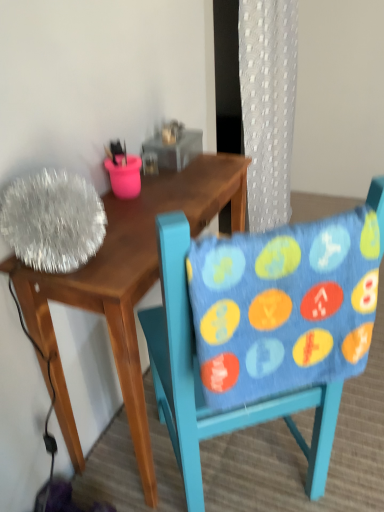
Question: From the image's perspective, is blue fabric chair at center located beneath blue fabric pillow at center?

Choices:
 (A) no
 (B) yes

Answer: (B)

Question: Does blue fabric chair at center turn towards blue fabric pillow at center?

Choices:
 (A) no
 (B) yes

Answer: (A)

Question: Can you confirm if blue fabric chair at center is positioned to the left of blue fabric pillow at center?

Choices:
 (A) yes
 (B) no

Answer: (A)

Question: Is blue fabric pillow at center inside blue fabric chair at center?

Choices:
 (A) no
 (B) yes

Answer: (B)

Question: Is blue fabric chair at center bigger than blue fabric pillow at center?

Choices:
 (A) yes
 (B) no

Answer: (A)

Question: Choose the correct answer: Is wooden desk at left inside blue fabric pillow at center or outside it?

Choices:
 (A) outside
 (B) inside

Answer: (A)

Question: From the image's perspective, is wooden desk at left positioned above or below blue fabric pillow at center?

Choices:
 (A) above
 (B) below

Answer: (B)

Question: Relative to blue fabric pillow at center, is wooden desk at left in front or behind?

Choices:
 (A) behind
 (B) front

Answer: (A)

Question: Considering the relative positions of wooden desk at left and blue fabric pillow at center in the image provided, is wooden desk at left to the left or to the right of blue fabric pillow at center?

Choices:
 (A) right
 (B) left

Answer: (B)

Question: Is blue fabric chair at center taller or shorter than blue fabric pillow at center?

Choices:
 (A) short
 (B) tall

Answer: (B)

Question: Looking at their shapes, would you say blue fabric chair at center is wider or thinner than blue fabric pillow at center?

Choices:
 (A) thin
 (B) wide

Answer: (B)

Question: Would you say blue fabric chair at center is to the left or to the right of blue fabric pillow at center in the picture?

Choices:
 (A) right
 (B) left

Answer: (B)

Question: From a real-world perspective, is blue fabric chair at center above or below blue fabric pillow at center?

Choices:
 (A) below
 (B) above

Answer: (A)

Question: In terms of width, does blue fabric chair at center look wider or thinner when compared to wooden desk at left?

Choices:
 (A) thin
 (B) wide

Answer: (B)

Question: From the image's perspective, relative to wooden desk at left, is blue fabric chair at center above or below?

Choices:
 (A) below
 (B) above

Answer: (A)